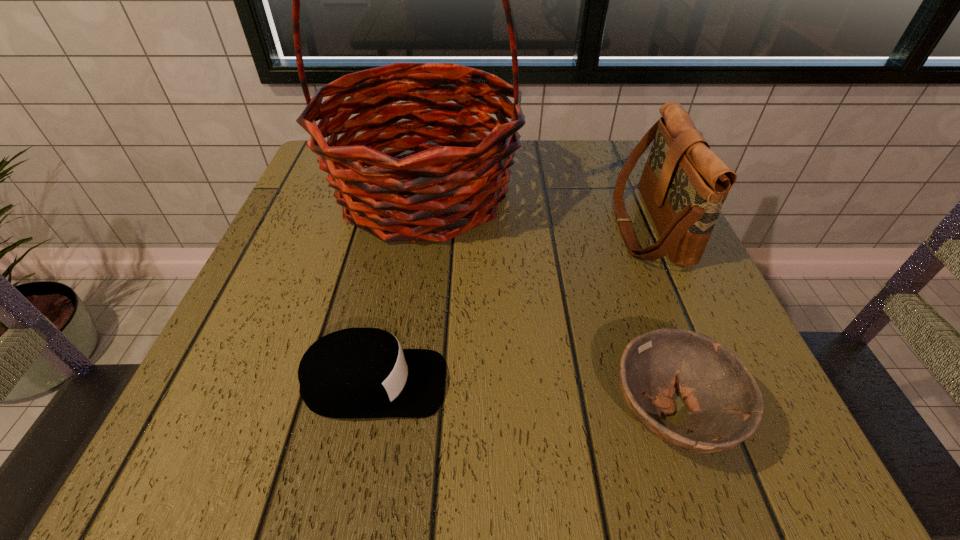
Locate an element on the screen. object that is at the far right corner is located at coordinates (684, 184).

Locate an element on the screen. object that is at the near right corner is located at coordinates (725, 403).

The width and height of the screenshot is (960, 540). What are the coordinates of `free spot at the far edge of the desktop` in the screenshot? It's located at (515, 158).

You are a GUI agent. You are given a task and a screenshot of the screen. Output one action in this format:
    pyautogui.click(x=<x>, y=<y>)
    Task: Click on the vacant region at the near edge of the desktop
    Image resolution: width=960 pixels, height=540 pixels.
    Given the screenshot: What is the action you would take?
    pyautogui.click(x=393, y=420)

Where is `vacant area at the left edge of the desktop`? The height and width of the screenshot is (540, 960). vacant area at the left edge of the desktop is located at coordinates (323, 262).

In the image, there is a desktop. Identify the location of vacant space at the right edge. This screenshot has width=960, height=540. (637, 302).

In the image, there is a desktop. What are the coordinates of `vacant space at the near left corner` in the screenshot? It's located at (179, 420).

In the image, there is a desktop. Identify the location of free space at the far right corner. The image size is (960, 540). (622, 168).

The image size is (960, 540). What are the coordinates of `vacant area that lies between the bowl and the cap` in the screenshot? It's located at (522, 399).

Locate an element on the screen. vacant area between the basket and the cap is located at coordinates (399, 288).